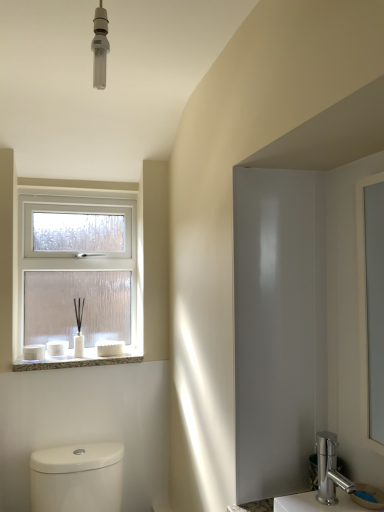
Question: From the image's perspective, is white textured stone at lower left above or below clear glass window at upper left?

Choices:
 (A) below
 (B) above

Answer: (A)

Question: Is white textured stone at lower left taller or shorter than clear glass window at upper left?

Choices:
 (A) tall
 (B) short

Answer: (B)

Question: Which object is positioned closest to the white glossy toilet at lower left?

Choices:
 (A) clear glass window at upper left
 (B) white textured stone at lower left
 (C) polished silver faucet at lower right
 (D) chrome metallic faucet at lower right

Answer: (B)

Question: Which of these objects is positioned closest to the chrome metallic faucet at lower right?

Choices:
 (A) white textured stone at lower left
 (B) white glossy toilet at lower left
 (C) clear glass window at upper left
 (D) polished silver faucet at lower right

Answer: (D)